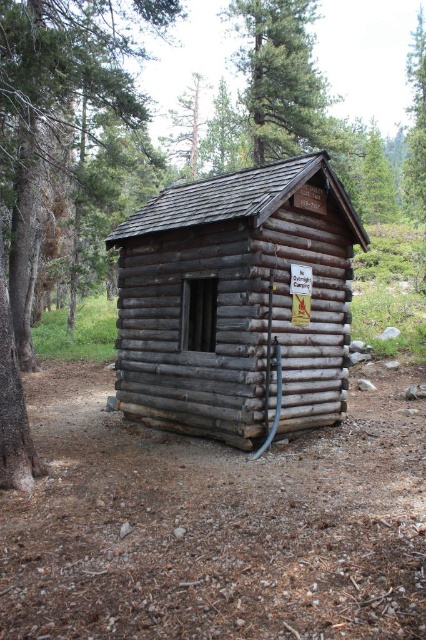
Question: Where is gray wooden log cabin at center located in relation to green leafy tree at upper center in the image?

Choices:
 (A) right
 (B) left

Answer: (B)

Question: Based on their relative distances, which object is farther from the gray wooden log cabin at center?

Choices:
 (A) smooth brown bark at left
 (B) green leafy tree at upper center

Answer: (B)

Question: Does gray wooden log cabin at center appear on the left side of smooth brown bark at left?

Choices:
 (A) no
 (B) yes

Answer: (A)

Question: Does gray wooden log cabin at center have a greater width compared to smooth brown bark at left?

Choices:
 (A) no
 (B) yes

Answer: (A)

Question: Which point is farther from the camera taking this photo?

Choices:
 (A) (313, 16)
 (B) (34, 96)

Answer: (A)

Question: Among these objects, which one is farthest from the camera?

Choices:
 (A) gray wooden log cabin at center
 (B) smooth brown bark at left

Answer: (A)